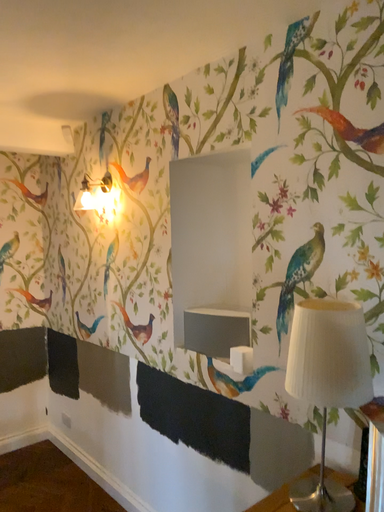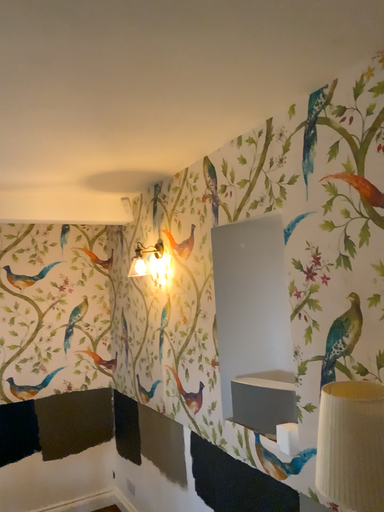
Question: How did the camera likely rotate when shooting the video?

Choices:
 (A) rotated right
 (B) rotated left

Answer: (B)